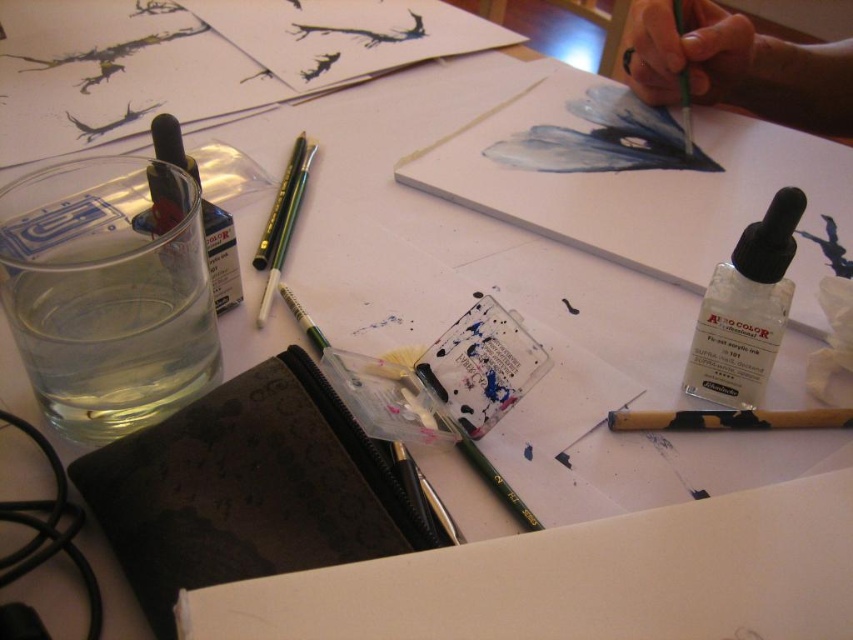
Who is taller, transparent glass at left or transparent plastic bottle at upper left?

transparent glass at left is taller.

Who is more forward, [107,157] or [233,292]?

Point [107,157]

Find the location of `transparent glass at left`. transparent glass at left is located at coordinates (108, 292).

Is the position of smooth blue feather at upper right less distant than that of transparent plastic bottle at upper left?

No, it is behind transparent plastic bottle at upper left.

Who is positioned more to the left, smooth blue feather at upper right or transparent plastic bottle at upper left?

transparent plastic bottle at upper left is more to the left.

You are a GUI agent. You are given a task and a screenshot of the screen. Output one action in this format:
    pyautogui.click(x=<x>, y=<y>)
    Task: Click on the smooth blue feather at upper right
    This screenshot has height=640, width=853.
    Given the screenshot: What is the action you would take?
    pyautogui.click(x=604, y=140)

Can you confirm if green paintbrush at upper right is wider than transparent plastic bottle at upper left?

Indeed, green paintbrush at upper right has a greater width compared to transparent plastic bottle at upper left.

Is green paintbrush at upper right positioned before transparent plastic bottle at upper left?

No, it is not.

Does point (703, 76) come closer to viewer compared to point (178, 154)?

No, it is not.

You are a GUI agent. You are given a task and a screenshot of the screen. Output one action in this format:
    pyautogui.click(x=<x>, y=<y>)
    Task: Click on the green paintbrush at upper right
    Image resolution: width=853 pixels, height=640 pixels.
    Given the screenshot: What is the action you would take?
    pyautogui.click(x=737, y=67)